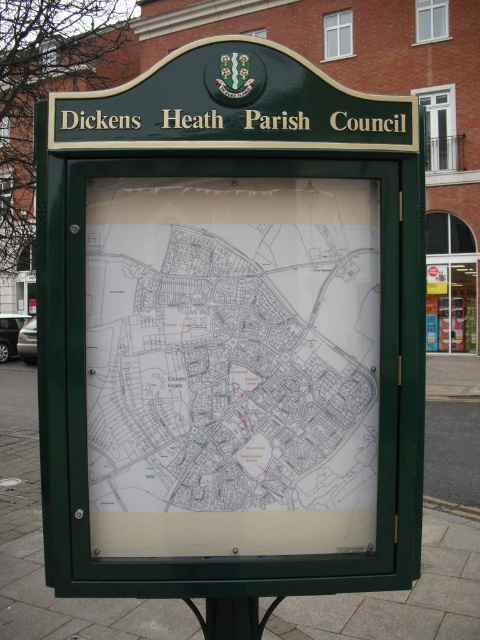
The image size is (480, 640). What are the coordinates of `white paper map at center` in the screenshot? It's located at (231, 365).

Can you confirm if white paper map at center is bigger than black plastic pole at lower center?

Indeed, white paper map at center has a larger size compared to black plastic pole at lower center.

This screenshot has height=640, width=480. Describe the element at coordinates (231, 365) in the screenshot. I see `white paper map at center` at that location.

Locate an element on the screen. The width and height of the screenshot is (480, 640). white paper map at center is located at coordinates (231, 365).